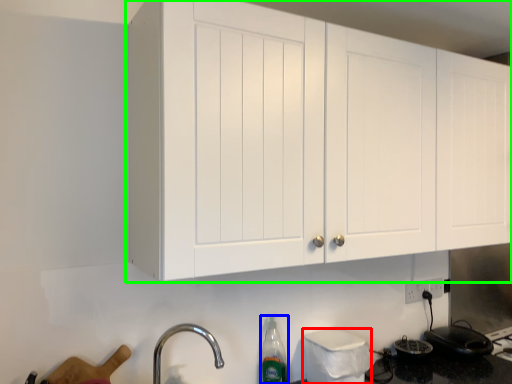
Question: Estimate the real-world distances between objects in this image. Which object is farther from appliance (highlighted by a red box), bottle (highlighted by a blue box) or cabinetry (highlighted by a green box)?

Choices:
 (A) bottle
 (B) cabinetry

Answer: (B)